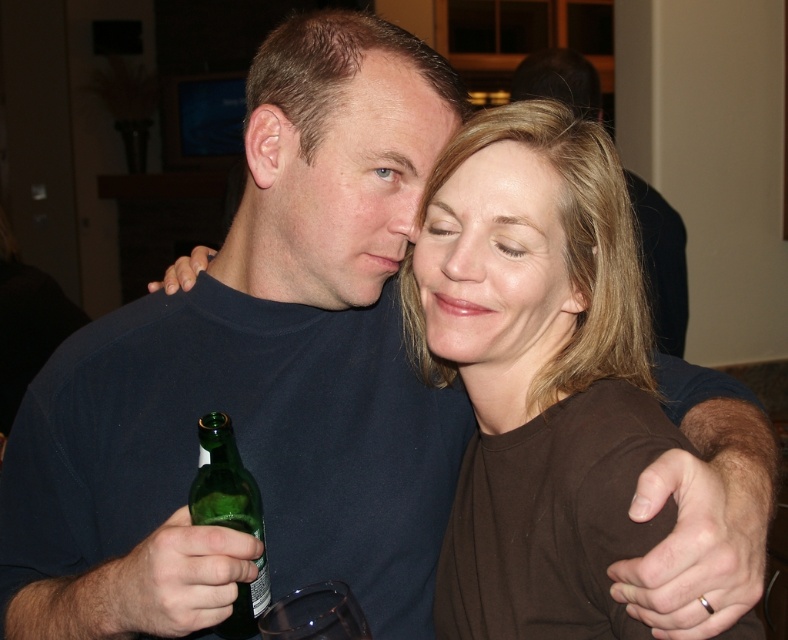
Who is lower down, matte black shirt at center or smooth skin at center?

smooth skin at center is lower down.

Where is `matte black shirt at center`? The width and height of the screenshot is (788, 640). matte black shirt at center is located at coordinates (660, 262).

Who is more distant from viewer, (653, 289) or (441, 93)?

Positioned behind is point (653, 289).

This screenshot has width=788, height=640. What are the coordinates of `matte black shirt at center` in the screenshot? It's located at (660, 262).

Does smooth skin face at center have a lesser width compared to green glass bottle at lower left?

In fact, smooth skin face at center might be wider than green glass bottle at lower left.

Looking at this image, who is higher up, smooth skin face at center or green glass bottle at lower left?

smooth skin face at center

Is point (430, 342) more distant than point (261, 506)?

Yes, it is.

Where is `smooth skin face at center`? smooth skin face at center is located at coordinates (496, 266).

Is brown matte shirt at center taller than matte black shirt at center?

No.

Between point (582, 452) and point (533, 68), which one is positioned behind?

Point (533, 68)

Does point (478, 285) come in front of point (656, 337)?

Yes, point (478, 285) is in front of point (656, 337).

I want to click on brown matte shirt at center, so click(528, 269).